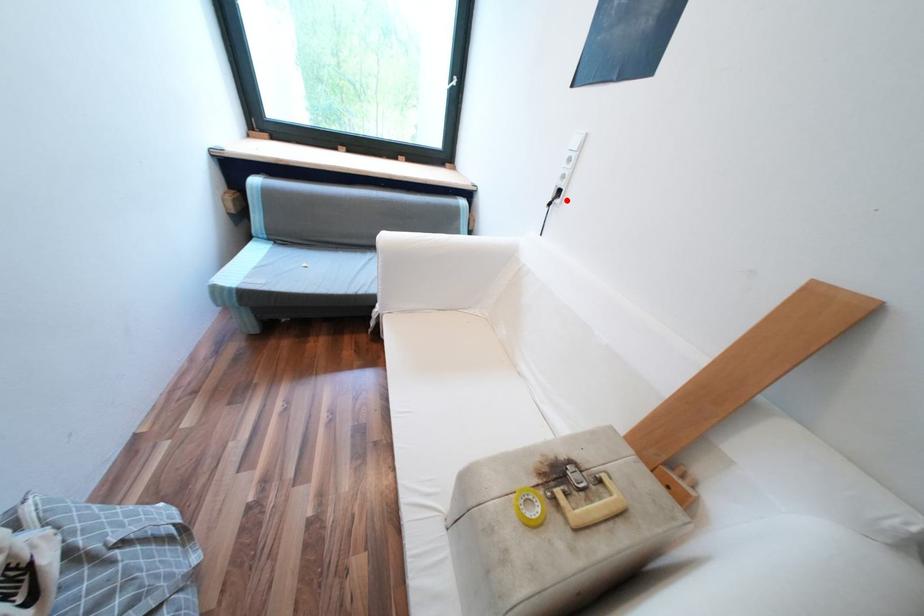
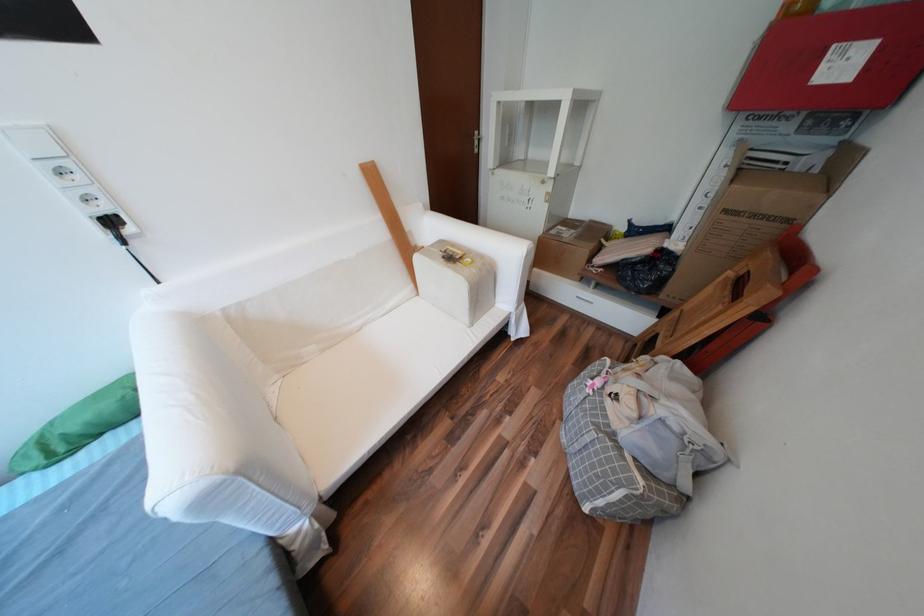
The point at the highlighted location is marked in the first image. Where is the corresponding point in the second image?

(138, 231)